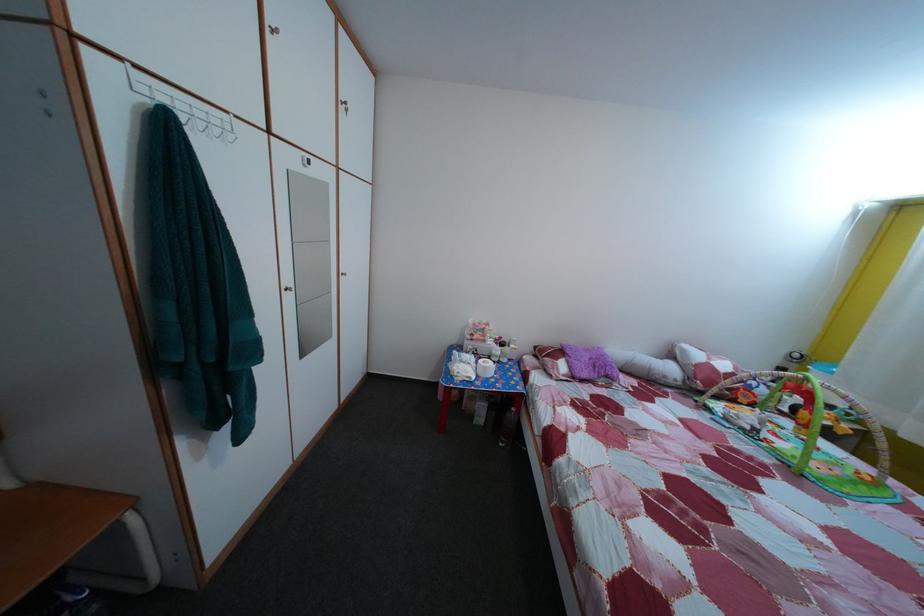
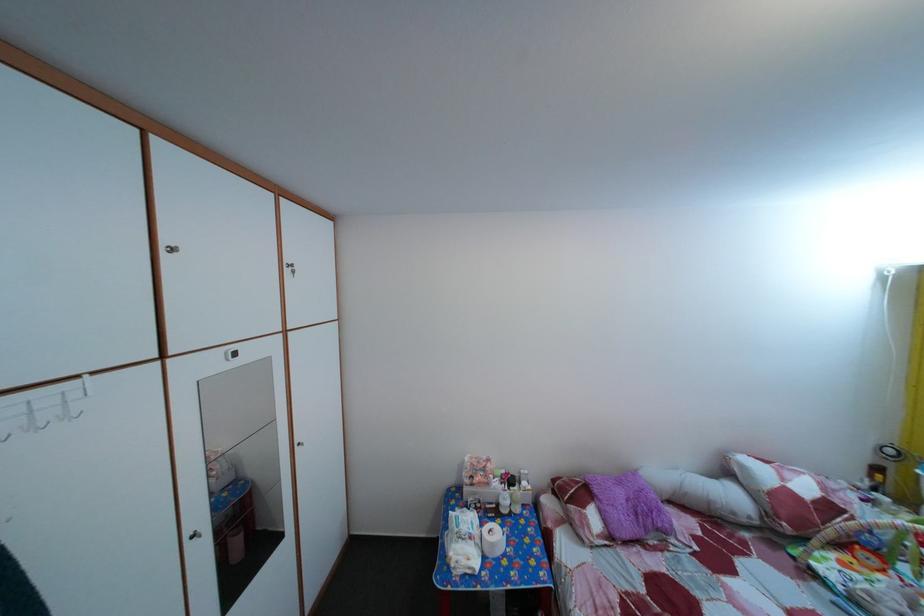
Find the pixel in the second image that matches pixel 494 376 in the first image.

(502, 553)